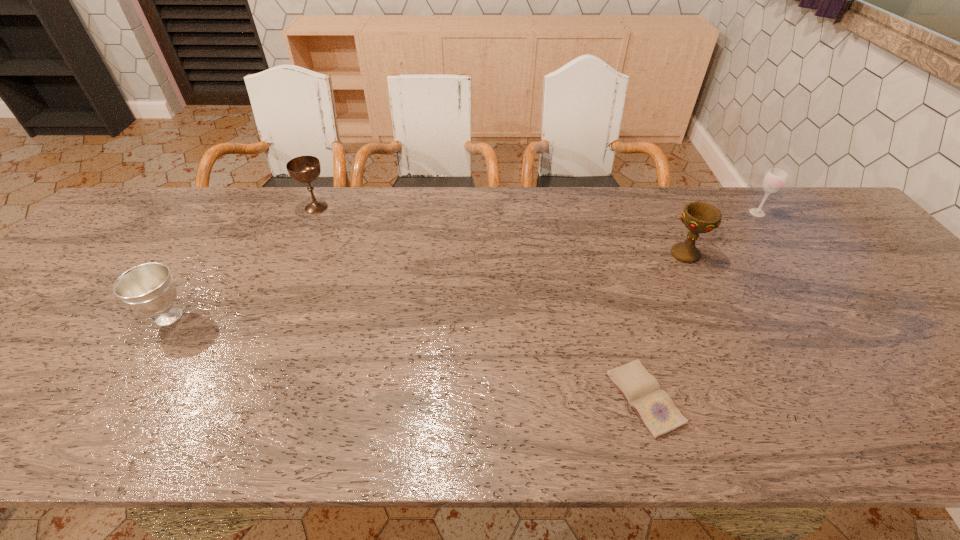
Find the location of a particular element. vacant space located on the right of the second nearest chalice is located at coordinates (763, 254).

Where is `free space located 0.310m on the left of the rightmost object`? The height and width of the screenshot is (540, 960). free space located 0.310m on the left of the rightmost object is located at coordinates [x=647, y=213].

The width and height of the screenshot is (960, 540). In order to click on vacant space situated on the back of the fourth farthest object in this screenshot , I will do `click(236, 212)`.

Find the location of a particular element. vacant space located 0.380m on the back of the shortest object is located at coordinates (601, 248).

Identify the location of chalice situated at the far edge. The image size is (960, 540). (304, 169).

In order to click on wineglass located in the far edge section of the desktop in this screenshot , I will do `click(774, 180)`.

Locate an element on the screen. This screenshot has height=540, width=960. object present at the near edge is located at coordinates (655, 408).

Where is `vacant space at the far edge`? This screenshot has width=960, height=540. vacant space at the far edge is located at coordinates (412, 188).

The image size is (960, 540). What are the coordinates of `vacant space at the near edge of the desktop` in the screenshot? It's located at pyautogui.click(x=312, y=425).

This screenshot has width=960, height=540. I want to click on free space at the far left corner of the desktop, so click(163, 210).